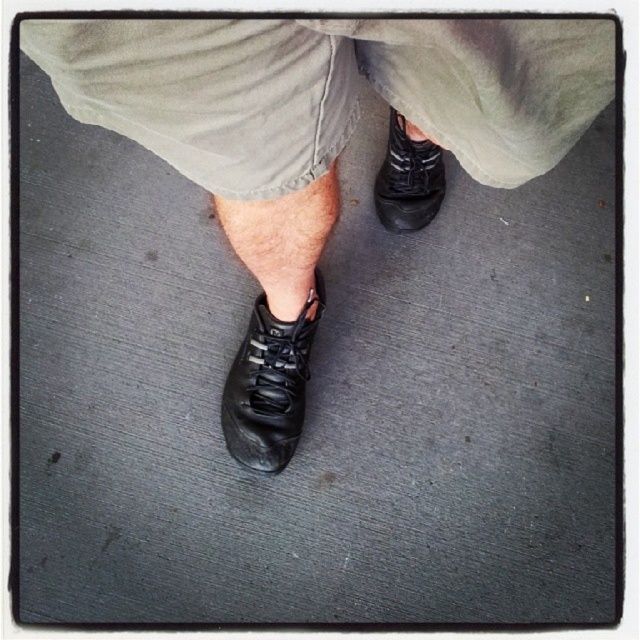
You are standing in a store trying to decide between two shoes. You see the black leather shoe at lower left and the matte black shoe at lower center. Which one is positioned more to the left?

The black leather shoe at lower left is positioned more to the left than the matte black shoe at lower center.

You are trying to decide which shoe to wear for a hike. You have a black leather shoe at center and a matte black shoe at lower center. Which one is taller?

The black leather shoe at center is taller than the matte black shoe at lower center, so you should choose the black leather shoe at center for better ankle support during the hike.